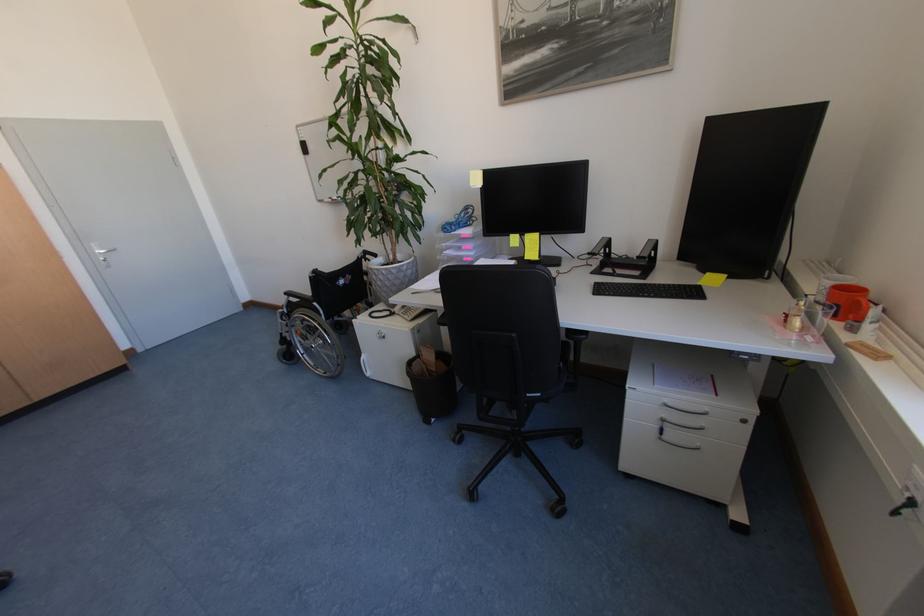
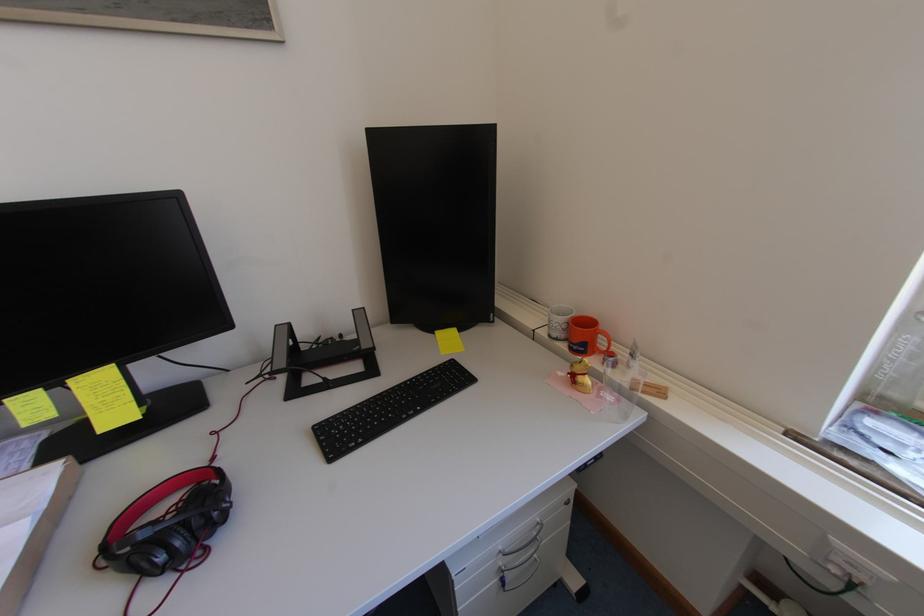
Question: Based on the continuous images, in which direction is the camera rotating? Reply with the corresponding letter.

Choices:
 (A) Left
 (B) Right
 (C) Up
 (D) Down

Answer: (B)